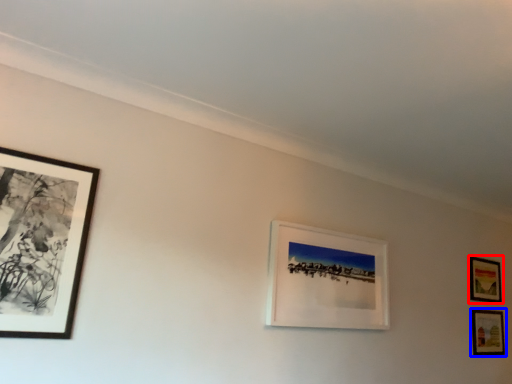
Question: Among these objects, which one is farthest to the camera, picture frame (highlighted by a red box) or picture frame (highlighted by a blue box)?

Choices:
 (A) picture frame
 (B) picture frame

Answer: (A)